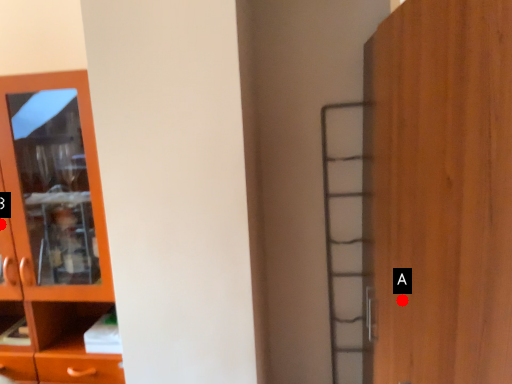
Question: Two points are circled on the image, labeled by A and B beside each circle. Which point appears closest to the camera in this image?

Choices:
 (A) A is closer
 (B) B is closer

Answer: (A)